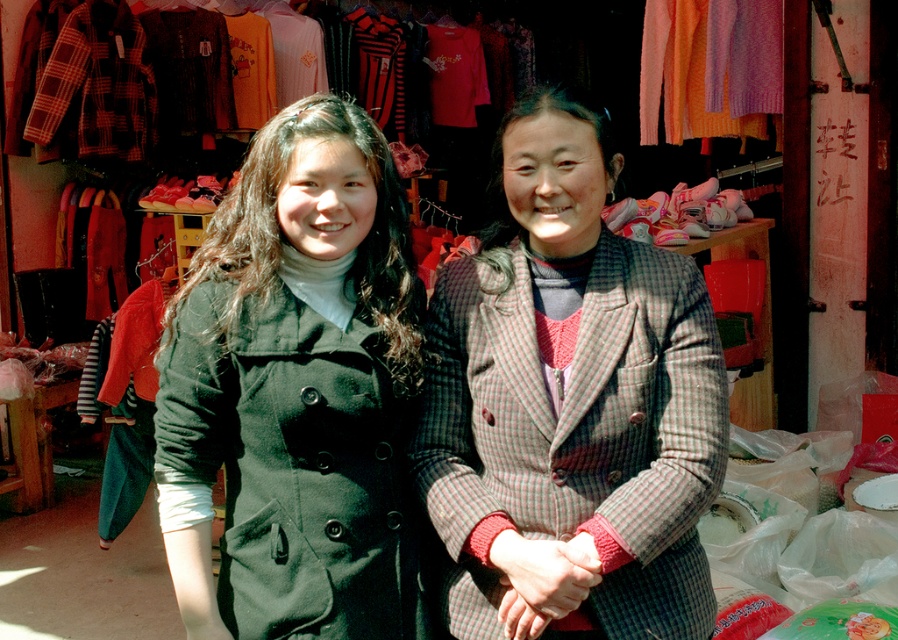
You are a photographer standing at the entrance of the shop. You want to take a photo that includes both the matte black coat at left and the plaid woolen jacket at center. Which object should you adjust your camera focus to first to ensure both are in the frame?

The matte black coat at left is further to the viewer than the plaid woolen jacket at center, so you should focus on the matte black coat at left first to ensure both are in the frame.

You are a photographer standing at the center of the scene. You want to take a photo of the person wearing the matte black coat at left. Where should you position yourself relative to the point at coordinates (x=301, y=385) to ensure the entire coat is in frame?

The point at coordinates (x=301, y=385) is located on the matte black coat at left. To capture the entire coat in the photo, position yourself so that the point is centered within your camera frame, ensuring the edges of the coat are visible.

You are a photographer trying to capture the matte black coat at left in the image. What are the coordinates where you should focus your camera?

The coordinates for the matte black coat at left are at point (x=301, y=385).